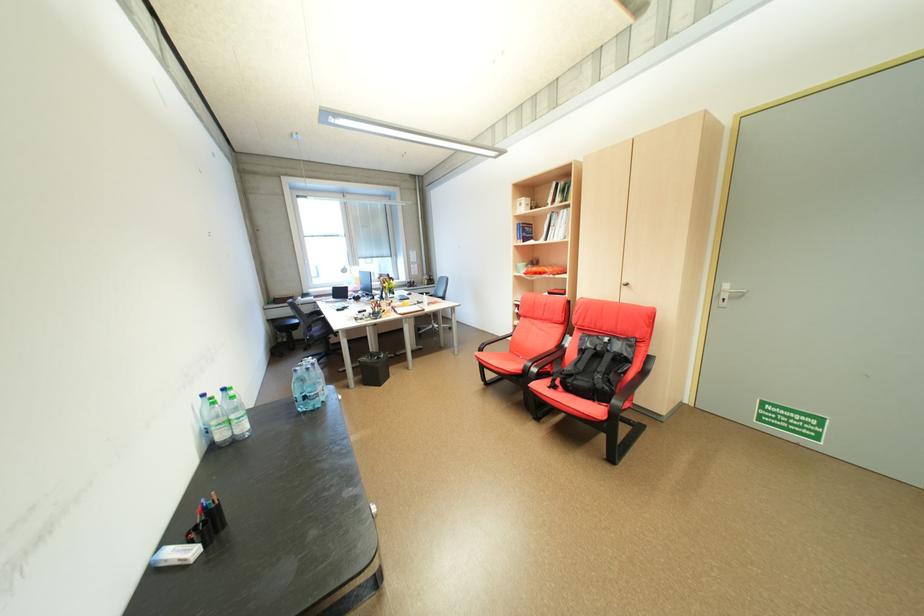
Where is `book on shelf`? The height and width of the screenshot is (616, 924). book on shelf is located at coordinates (524, 232).